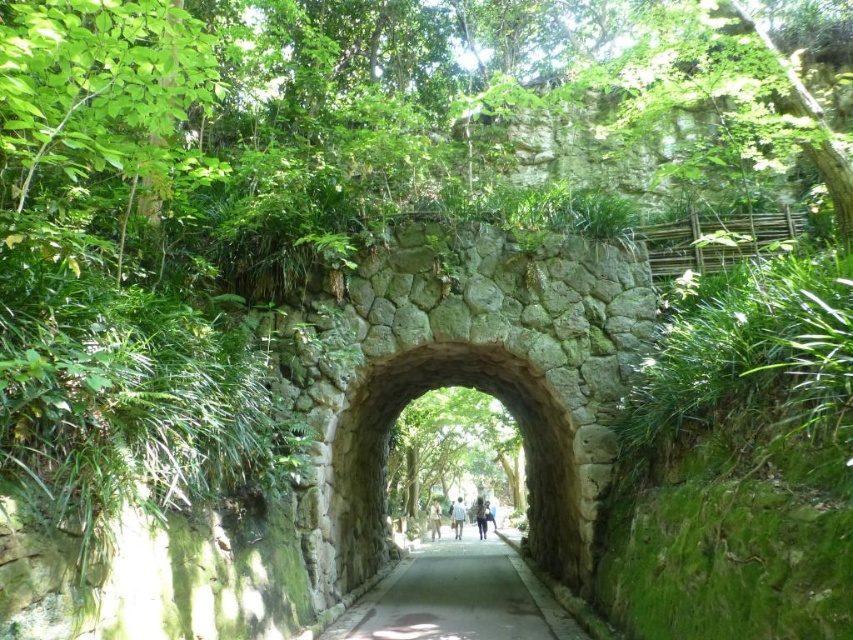
You are standing at the entrance of the forest and see the natural stone archway at center. If you walk straight ahead, will you be facing the archway?

Yes, since the natural stone archway at center is positioned at the center of the scene, walking straight ahead would lead you directly towards it.

You are a hiker carrying a blue fabric bag at center and want to walk along the gray concrete path at center. Can you determine if the path is wide enough for you and your bag?

The gray concrete path at center might be wider than blue fabric bag at center, so it is possible that the path is wide enough for you and your bag, but there is uncertainty due to the comparative description.